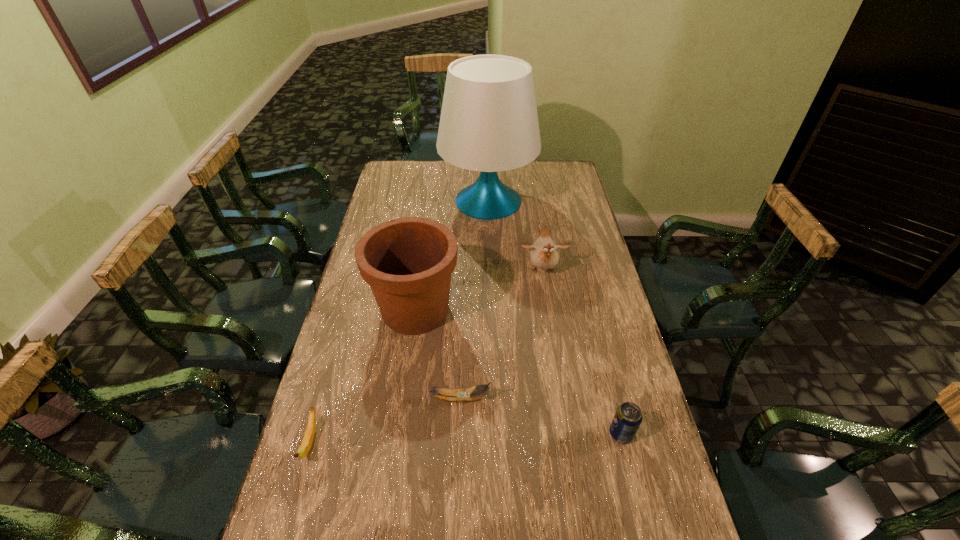
At what (x,y) coordinates should I click in order to perform the action: click on table lamp. Please return your answer as a coordinate pair (x, y). This screenshot has height=540, width=960. Looking at the image, I should click on [x=489, y=122].

Where is `the tallest object`? the tallest object is located at coordinates (489, 122).

Identify the location of the second tallest object. The image size is (960, 540). (408, 262).

What are the coordinates of `the fourth shortest object` in the screenshot? It's located at (543, 254).

Identify the location of the fourth tallest object. The image size is (960, 540). (x=628, y=416).

Image resolution: width=960 pixels, height=540 pixels. Identify the location of the third nearest object. (471, 393).

Where is `the second shortest object`? This screenshot has width=960, height=540. the second shortest object is located at coordinates (471, 393).

Identify the location of the shorter banana. The image size is (960, 540). (306, 444).

The width and height of the screenshot is (960, 540). Identify the location of the nearer banana. (306, 444).

Identify the location of free space located on the front-facing side of the tallest object. This screenshot has width=960, height=540. (386, 201).